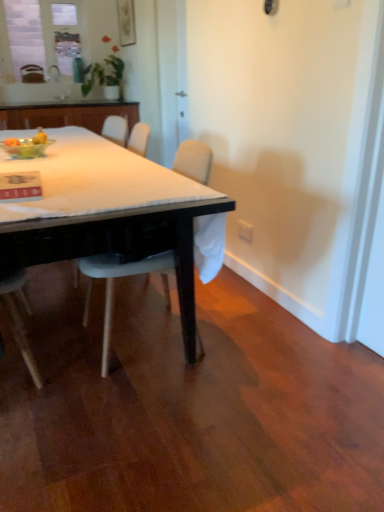
Measure the distance between point (59,72) and camera.

Point (59,72) and camera are 17.44 feet apart.

What do you see at coordinates (113, 287) in the screenshot? I see `white plastic chair at center, the first chair from the bottom` at bounding box center [113, 287].

The image size is (384, 512). What do you see at coordinates (29, 35) in the screenshot?
I see `matte glass window at upper left` at bounding box center [29, 35].

Find the location of a particular element. This screenshot has width=384, height=512. white glossy sink at upper center is located at coordinates (58, 84).

In terms of height, does white plastic chair at upper left, which appears as the second chair when ordered from the bottom, look taller or shorter compared to white plastic power outlet at lower right?

Considering their sizes, white plastic chair at upper left, which appears as the second chair when ordered from the bottom, has more height than white plastic power outlet at lower right.

Is white plastic chair at upper left, which appears as the 1th chair when viewed from the back, not inside white plastic power outlet at lower right?

Yes, white plastic chair at upper left, which appears as the 1th chair when viewed from the back, is not within white plastic power outlet at lower right.

Where is `power outlet below the white plastic chair at upper left, which appears as the second chair when ordered from the bottom (from the image's perspective)`? The image size is (384, 512). power outlet below the white plastic chair at upper left, which appears as the second chair when ordered from the bottom (from the image's perspective) is located at coordinates (245, 230).

Which object is wider, white plastic chair at upper left, which is counted as the second chair, starting from the front, or white plastic power outlet at lower right?

white plastic chair at upper left, which is counted as the second chair, starting from the front.

Considering the relative sizes of matte wooden picture frame at upper center and translucent glass bowl at upper left in the image provided, is matte wooden picture frame at upper center wider than translucent glass bowl at upper left?

No, matte wooden picture frame at upper center is not wider than translucent glass bowl at upper left.

From the picture: Is matte wooden picture frame at upper center oriented towards translucent glass bowl at upper left?

No, matte wooden picture frame at upper center does not turn towards translucent glass bowl at upper left.

Does point (124, 39) come closer to viewer compared to point (25, 145)?

That is False.

Between matte wooden picture frame at upper center and translucent glass bowl at upper left, which one is positioned behind?

matte wooden picture frame at upper center is further from the camera.

Is matte wooden picture frame at upper center at the back of matte black table at center?

matte black table at center is not turned away from matte wooden picture frame at upper center.

From the image's perspective, which is above, matte black table at center or matte wooden picture frame at upper center?

matte wooden picture frame at upper center is shown above in the image.

From a real-world perspective, which object stands above the other?

From a 3D spatial view, matte wooden picture frame at upper center is above.

From a real-world perspective, is matte black table at center on white glossy sink at upper center?

No.

Is matte black table at center inside the boundaries of white glossy sink at upper center, or outside?

matte black table at center cannot be found inside white glossy sink at upper center.

How far apart are matte black table at center and white glossy sink at upper center?

matte black table at center is 3.86 meters from white glossy sink at upper center.

Considering the sizes of matte black table at center and white glossy sink at upper center in the image, is matte black table at center taller or shorter than white glossy sink at upper center?

matte black table at center is shorter than white glossy sink at upper center.

Based on the photo, between white plastic chair at center, acting as the second chair starting from the left, and wooden cabinet at upper left, which one has smaller size?

white plastic chair at center, acting as the second chair starting from the left.

Could you tell me if white plastic chair at center, the first chair from the bottom, is turned towards wooden cabinet at upper left?

No, white plastic chair at center, the first chair from the bottom, is not facing towards wooden cabinet at upper left.

From a real-world perspective, is white plastic chair at center, marked as the 2th chair in a back-to-front arrangement, above or below wooden cabinet at upper left?

Clearly, from a real-world perspective, white plastic chair at center, marked as the 2th chair in a back-to-front arrangement, is below wooden cabinet at upper left.

Is matte glass window at upper left at the back of wooden cabinet at upper left?

No, wooden cabinet at upper left's orientation is not away from matte glass window at upper left.

Is wooden cabinet at upper left far from matte glass window at upper left?

Yes.

Who is bigger, wooden cabinet at upper left or matte glass window at upper left?

Bigger between the two is wooden cabinet at upper left.

Considering the sizes of objects wooden cabinet at upper left and matte glass window at upper left in the image provided, who is thinner, wooden cabinet at upper left or matte glass window at upper left?

Thinner between the two is matte glass window at upper left.

Is wooden cabinet at upper left completely or partially inside matte glass window at upper left?

No.

Does point (5, 65) lie behind point (51, 111)?

Yes, point (5, 65) is behind point (51, 111).

Can you confirm if matte glass window at upper left is thinner than wooden cabinet at upper left?

Yes.

Between matte glass window at upper left and wooden cabinet at upper left, which one has more height?

matte glass window at upper left.

Where is `the 2nd chair to the left of the white plastic power outlet at lower right, counting from the anchor's position`? Image resolution: width=384 pixels, height=512 pixels. the 2nd chair to the left of the white plastic power outlet at lower right, counting from the anchor's position is located at coordinates (32, 74).

I want to click on picture frame located behind the translucent glass bowl at upper left, so click(x=126, y=22).

From the image, which object appears to be farther from matte black table at center, matte glass window at upper left or transparent glass bottle at upper center?

matte glass window at upper left is further to matte black table at center.

Looking at the image, which one is located further to transparent glass bottle at upper center, white plastic power outlet at lower right or matte black table at center?

matte black table at center is further to transparent glass bottle at upper center.

When comparing their distances from white plastic chair at center, which appears as the first chair when viewed from the right, does matte glass window at upper left or wooden cabinet at upper left seem further?

Based on the image, matte glass window at upper left appears to be further to white plastic chair at center, which appears as the first chair when viewed from the right.

Which object lies nearer to the anchor point white plastic chair at upper left, which appears as the 1th chair when viewed from the back, white glossy sink at upper center or matte black table at center?

The object closer to white plastic chair at upper left, which appears as the 1th chair when viewed from the back, is white glossy sink at upper center.

When comparing their distances from translucent glass bowl at upper left, does white plastic chair at upper left, which appears as the 1th chair when viewed from the back, or matte glass window at upper left seem closer?

white plastic chair at upper left, which appears as the 1th chair when viewed from the back, is positioned closer to the anchor translucent glass bowl at upper left.

Looking at the image, which one is located further to translucent glass bowl at upper left, matte wooden picture frame at upper center or white plastic power outlet at lower right?

matte wooden picture frame at upper center.

From the picture: Looking at the image, which one is located further to white plastic chair at center, which appears as the second chair when viewed from the top, white glossy sink at upper center or white plastic chair at upper left, arranged as the first chair when viewed from the left?

white plastic chair at upper left, arranged as the first chair when viewed from the left, lies further to white plastic chair at center, which appears as the second chair when viewed from the top, than the other object.

When comparing their distances from translucent glass bowl at upper left, does transparent glass bottle at upper center or wooden cabinet at upper left seem further?

Based on the image, transparent glass bottle at upper center appears to be further to translucent glass bowl at upper left.

Identify the location of sink between white plastic power outlet at lower right and transparent glass bottle at upper center from front to back. The width and height of the screenshot is (384, 512). (58, 84).

The image size is (384, 512). I want to click on picture frame between matte black table at center and white plastic chair at upper left, which is counted as the 2th chair, starting from the right, in the front-back direction, so click(x=126, y=22).

Where is `cabinetry between translucent glass bowl at upper left and matte glass window at upper left in the front-back direction`? The image size is (384, 512). cabinetry between translucent glass bowl at upper left and matte glass window at upper left in the front-back direction is located at coordinates (67, 115).

At what (x,y) coordinates should I click in order to perform the action: click on chair between matte glass window at upper left and white glossy sink at upper center vertically. Please return your answer as a coordinate pair (x, y). This screenshot has width=384, height=512. Looking at the image, I should click on (32, 74).